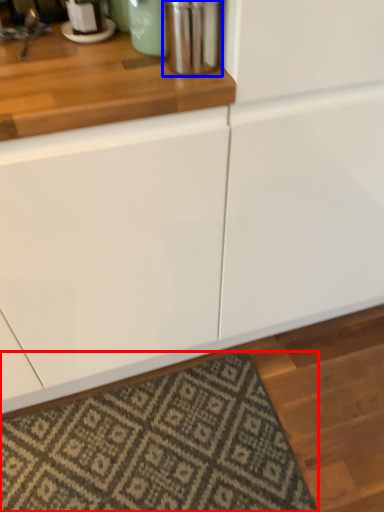
Question: Which object appears closest to the camera in this image, mat (highlighted by a red box) or appliance (highlighted by a blue box)?

Choices:
 (A) mat
 (B) appliance

Answer: (B)